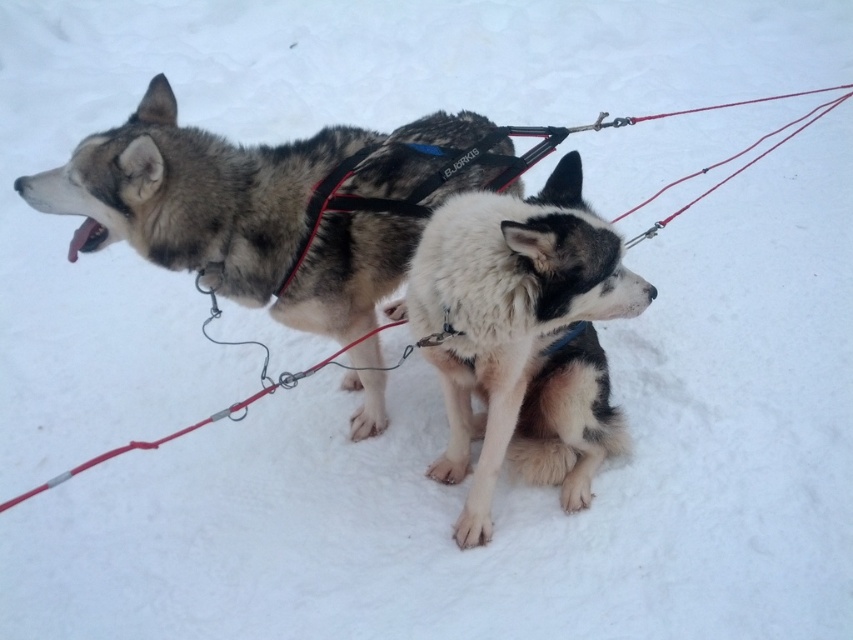
Which of these two, dark gray fur at center or fuzzy white fur at center, stands taller?

dark gray fur at center is taller.

In order to click on dark gray fur at center in this screenshot , I will do `click(192, 195)`.

Which is behind, point (329, 246) or point (604, 317)?

Point (329, 246)

The width and height of the screenshot is (853, 640). I want to click on dark gray fur at center, so click(x=192, y=195).